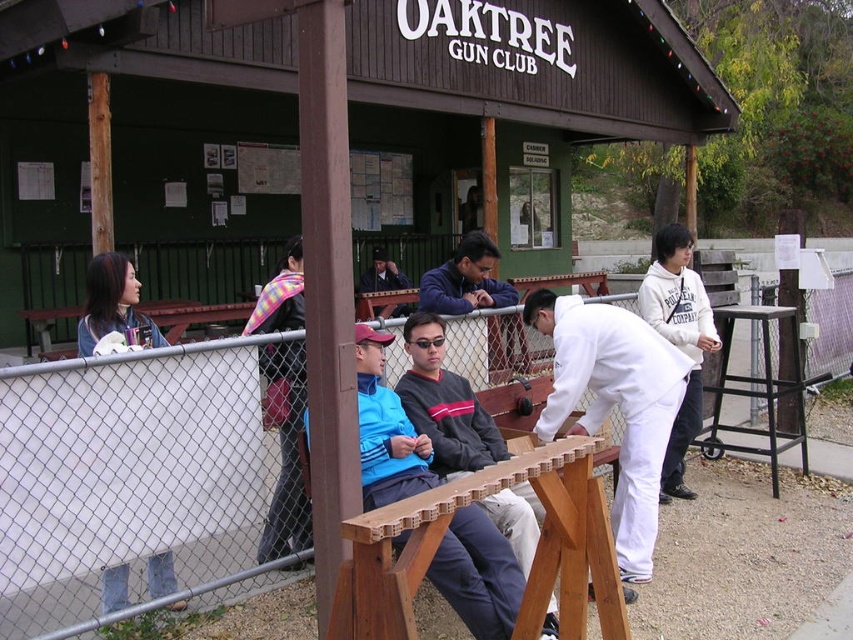
Looking at this image, you are a photographer at the Oaktree Gun Club and need to capture a clear photo of both the white matte shirt at center and the white fleece sweatshirt at center. Which clothing item appears shorter in the photo?

The white matte shirt at center appears shorter in the photo because it has a lesser height compared to the white fleece sweatshirt at center.

You are planning to place a 3 meter long banner between the wooden picnic table at center and the white fleece sweatshirt at center. Is there enough space to fit the banner horizontally between them?

The wooden picnic table at center and the white fleece sweatshirt at center are 2.72 meters apart. Since the banner is 3 meters long, which is longer than the distance between them, there is not enough space to fit the banner horizontally between them.

Consider the image. You are planning to have a picnic at the Oaktree Gun Club. There is a wooden picnic table at center and a white fleece sweatshirt at center. Where is the wooden picnic table located in relation to the white fleece sweatshirt?

The wooden picnic table at center is positioned under the white fleece sweatshirt at center.